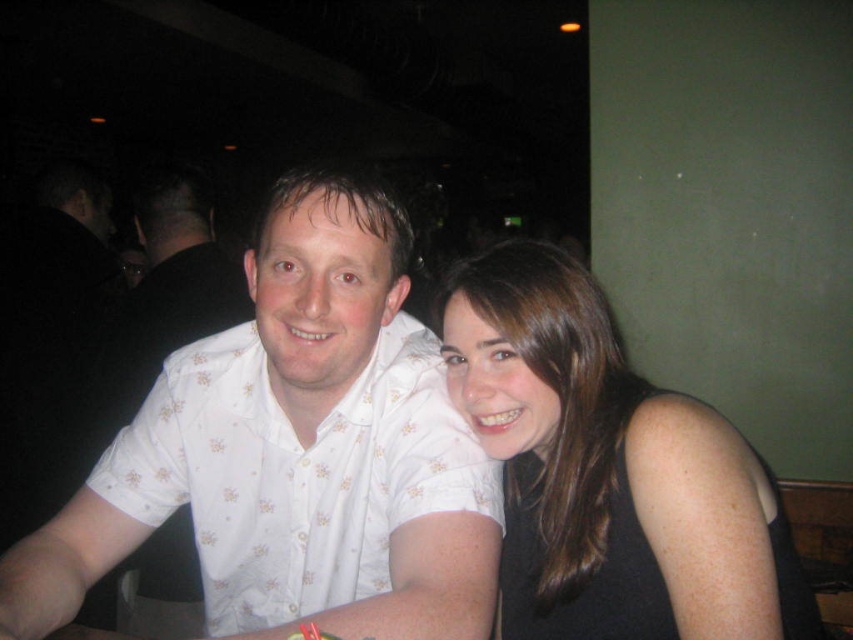
Question: In this image, where is black fabric at center located relative to white floral shirt at left?

Choices:
 (A) above
 (B) below

Answer: (B)

Question: Considering the real-world distances, which object is farthest from the white floral shirt at left?

Choices:
 (A) black fabric at center
 (B) white floral shirt at center

Answer: (A)

Question: Does black fabric at center have a greater width compared to white floral shirt at left?

Choices:
 (A) no
 (B) yes

Answer: (A)

Question: Considering the real-world distances, which object is closest to the black fabric at center?

Choices:
 (A) white floral shirt at center
 (B) white floral shirt at left

Answer: (A)

Question: Among these points, which one is farthest from the camera?

Choices:
 (A) (373, 525)
 (B) (192, 529)
 (C) (682, 531)

Answer: (B)

Question: Can you confirm if white floral shirt at center is positioned above white floral shirt at left?

Choices:
 (A) yes
 (B) no

Answer: (B)